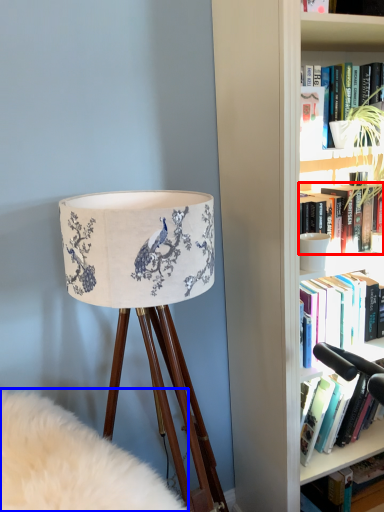
Question: Which of the following is the farthest to the observer, book (highlighted by a red box) or plain (highlighted by a blue box)?

Choices:
 (A) book
 (B) plain

Answer: (A)